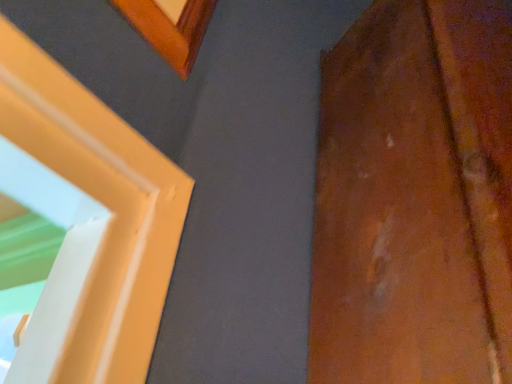
Question: Should I look upward or downward to see wooden door at right?

Choices:
 (A) down
 (B) up

Answer: (A)